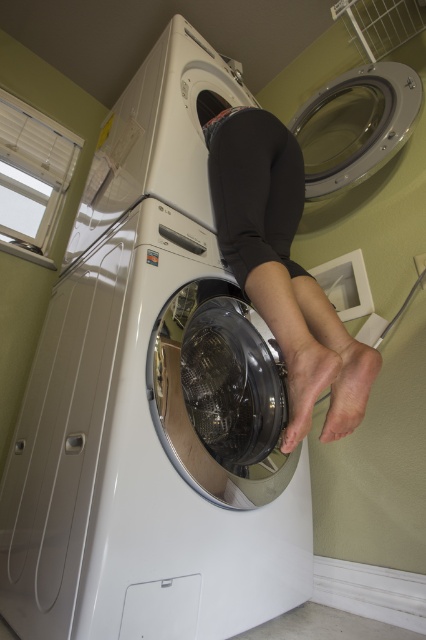
You are a repair technician who needs to access the transparent glass door at center and the pink smooth foot at lower right. Based on the scene, which object is positioned higher from the floor?

The transparent glass door at center is located above the pink smooth foot at lower right, so the transparent glass door at center is higher from the floor.

You are a delivery person who just arrived at this laundry room to deliver a new appliance. You need to place a small package between the white glossy washing machine at center and the matte black foot at lower center. Can you fit it there?

The white glossy washing machine at center is bigger than the matte black foot at lower center, so there might not be enough space between them to fit a small package. Check the available space carefully before placing the package.

You are a delivery person who just arrived at the house. You see the white glossy washing machine at center and the matte black foot at lower center. Which object is closer to you?

The white glossy washing machine at center is closer to you because it is in front of the matte black foot at lower center.